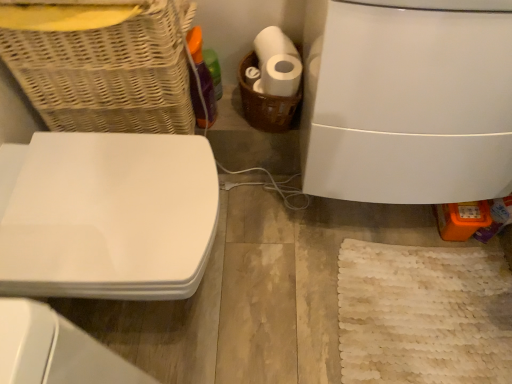
This screenshot has height=384, width=512. Describe the element at coordinates (110, 217) in the screenshot. I see `white glossy toilet seat at left` at that location.

Find the location of a particular element. Image resolution: width=512 pixels, height=384 pixels. woven wicker basket at upper left, which is counted as the second basket, starting from the right is located at coordinates (104, 67).

Considering the sizes of objects white glossy toilet seat at left and translucent purple bottle at upper left in the image provided, who is wider, white glossy toilet seat at left or translucent purple bottle at upper left?

white glossy toilet seat at left.

Is white glossy toilet seat at left at the right side of translucent purple bottle at upper left?

In fact, white glossy toilet seat at left is to the left of translucent purple bottle at upper left.

From the image's perspective, which one is positioned higher, white glossy toilet seat at left or translucent purple bottle at upper left?

translucent purple bottle at upper left.

Considering the points (11, 222) and (211, 120), which point is behind, point (11, 222) or point (211, 120)?

Positioned behind is point (211, 120).

Does woven wicker basket at upper left, which is counted as the second basket, starting from the right, have a smaller size compared to white glossy toilet seat at left?

Correct, woven wicker basket at upper left, which is counted as the second basket, starting from the right, occupies less space than white glossy toilet seat at left.

Which is behind, woven wicker basket at upper left, which is counted as the second basket, starting from the right, or white glossy toilet seat at left?

white glossy toilet seat at left is further from the camera.

Is woven wicker basket at upper left, which is counted as the second basket, starting from the right, smaller than white glossy toilet at right?

Indeed, woven wicker basket at upper left, which is counted as the second basket, starting from the right, has a smaller size compared to white glossy toilet at right.

Is woven wicker basket at upper left, which is counted as the second basket, starting from the right, not near white glossy toilet at right?

No, woven wicker basket at upper left, which is counted as the second basket, starting from the right, is in close proximity to white glossy toilet at right.

Consider the image. From a real-world perspective, between woven wicker basket at upper left, which is counted as the second basket, starting from the right, and white glossy toilet at right, who is vertically lower?

white glossy toilet at right is physically lower.

Which of these two, woven wicker basket at upper left, which is counted as the second basket, starting from the right, or white glossy toilet at right, is thinner?

Thinner between the two is woven wicker basket at upper left, which is counted as the second basket, starting from the right.

Who is shorter, brown woven basket at center, positioned as the first basket in right-to-left order, or white glossy toilet seat at left?

With less height is brown woven basket at center, positioned as the first basket in right-to-left order.

Which is behind, brown woven basket at center, positioned as the first basket in right-to-left order, or white glossy toilet seat at left?

brown woven basket at center, positioned as the first basket in right-to-left order, is further from the camera.

The image size is (512, 384). In the image, there is a brown woven basket at center, which is the second basket in left-to-right order. Find the location of `toilet below it (from the image's perspective)`. toilet below it (from the image's perspective) is located at coordinates (110, 217).

From a real-world perspective, relative to white glossy toilet seat at left, is brown woven basket at center, positioned as the first basket in right-to-left order, vertically above or below?

Clearly, from a real-world perspective, brown woven basket at center, positioned as the first basket in right-to-left order, is above white glossy toilet seat at left.

Are woven wicker basket at upper left, placed as the 1th basket when sorted from left to right, and brown woven basket at center, positioned as the first basket in right-to-left order, far apart?

No, there isn't a large distance between woven wicker basket at upper left, placed as the 1th basket when sorted from left to right, and brown woven basket at center, positioned as the first basket in right-to-left order.

From a real-world perspective, is woven wicker basket at upper left, placed as the 1th basket when sorted from left to right, positioned above or below brown woven basket at center, which is the second basket in left-to-right order?

In terms of real-world spatial position, woven wicker basket at upper left, placed as the 1th basket when sorted from left to right, is above brown woven basket at center, which is the second basket in left-to-right order.

What's the angular difference between woven wicker basket at upper left, which is counted as the second basket, starting from the right, and brown woven basket at center, which is the second basket in left-to-right order,'s facing directions?

2.1 degrees.

Is woven wicker basket at upper left, which is counted as the second basket, starting from the right, positioned before brown woven basket at center, which is the second basket in left-to-right order?

Yes, the depth of woven wicker basket at upper left, which is counted as the second basket, starting from the right, is less than that of brown woven basket at center, which is the second basket in left-to-right order.

Which is in front, brown woven basket at center, positioned as the first basket in right-to-left order, or translucent purple bottle at upper left?

Positioned in front is translucent purple bottle at upper left.

Find the location of a particular element. The height and width of the screenshot is (384, 512). bottle in front of the brown woven basket at center, positioned as the first basket in right-to-left order is located at coordinates (202, 73).

Does brown woven basket at center, positioned as the first basket in right-to-left order, have a lesser width compared to translucent purple bottle at upper left?

No, brown woven basket at center, positioned as the first basket in right-to-left order, is not thinner than translucent purple bottle at upper left.

Is translucent purple bottle at upper left surrounded by brown woven basket at center, which is the second basket in left-to-right order?

No.

Considering the sizes of objects brown woven basket at center, which is the second basket in left-to-right order, and white glossy toilet at right in the image provided, who is thinner, brown woven basket at center, which is the second basket in left-to-right order, or white glossy toilet at right?

brown woven basket at center, which is the second basket in left-to-right order, is thinner.

Locate an element on the screen. The image size is (512, 384). appliance in front of the brown woven basket at center, which is the second basket in left-to-right order is located at coordinates (407, 100).

From the image's perspective, is brown woven basket at center, positioned as the first basket in right-to-left order, positioned above or below white glossy toilet at right?

Clearly, from the image's perspective, brown woven basket at center, positioned as the first basket in right-to-left order, is above white glossy toilet at right.

Considering the relative sizes of brown woven basket at center, positioned as the first basket in right-to-left order, and white glossy toilet at right in the image provided, is brown woven basket at center, positioned as the first basket in right-to-left order, smaller than white glossy toilet at right?

Correct, brown woven basket at center, positioned as the first basket in right-to-left order, occupies less space than white glossy toilet at right.

You are a GUI agent. You are given a task and a screenshot of the screen. Output one action in this format:
    pyautogui.click(x=<x>, y=<y>)
    Task: Click on the toilet in front of the translucent purple bottle at upper left
    The height and width of the screenshot is (384, 512).
    Given the screenshot: What is the action you would take?
    pyautogui.click(x=110, y=217)

Find the location of a particular element. This screenshot has width=512, height=384. toilet to the left of woven wicker basket at upper left, placed as the 1th basket when sorted from left to right is located at coordinates (110, 217).

Estimate the real-world distances between objects in this image. Which object is further from brown woven basket at center, which is the second basket in left-to-right order, white glossy toilet at right or translucent purple bottle at upper left?

white glossy toilet at right is positioned further to the anchor brown woven basket at center, which is the second basket in left-to-right order.

In the scene shown: From the image, which object appears to be farther from brown woven basket at center, positioned as the first basket in right-to-left order, white glossy toilet at right or woven wicker basket at upper left, placed as the 1th basket when sorted from left to right?

Among the two, woven wicker basket at upper left, placed as the 1th basket when sorted from left to right, is located further to brown woven basket at center, positioned as the first basket in right-to-left order.

Estimate the real-world distances between objects in this image. Which object is closer to translucent purple bottle at upper left, white glossy toilet at right or brown woven basket at center, positioned as the first basket in right-to-left order?

brown woven basket at center, positioned as the first basket in right-to-left order, is positioned closer to the anchor translucent purple bottle at upper left.

In the scene shown: Based on their spatial positions, is brown woven basket at center, positioned as the first basket in right-to-left order, or woven wicker basket at upper left, placed as the 1th basket when sorted from left to right, further from white glossy toilet seat at left?

Among the two, brown woven basket at center, positioned as the first basket in right-to-left order, is located further to white glossy toilet seat at left.

Looking at the image, which one is located further to white glossy toilet at right, brown woven basket at center, positioned as the first basket in right-to-left order, or translucent purple bottle at upper left?

translucent purple bottle at upper left lies further to white glossy toilet at right than the other object.

Estimate the real-world distances between objects in this image. Which object is closer to woven wicker basket at upper left, which is counted as the second basket, starting from the right, translucent purple bottle at upper left or brown woven basket at center, which is the second basket in left-to-right order?

translucent purple bottle at upper left.

Looking at the image, which one is located further to white glossy toilet seat at left, woven wicker basket at upper left, placed as the 1th basket when sorted from left to right, or translucent purple bottle at upper left?

Among the two, translucent purple bottle at upper left is located further to white glossy toilet seat at left.

From the picture: Looking at the image, which one is located closer to translucent purple bottle at upper left, white glossy toilet at right or white glossy toilet seat at left?

white glossy toilet seat at left is positioned closer to the anchor translucent purple bottle at upper left.

Where is `basket between woven wicker basket at upper left, which is counted as the second basket, starting from the right, and white glossy toilet at right from left to right`? The height and width of the screenshot is (384, 512). basket between woven wicker basket at upper left, which is counted as the second basket, starting from the right, and white glossy toilet at right from left to right is located at coordinates (266, 103).

I want to click on basket between translucent purple bottle at upper left and white glossy toilet at right, so click(266, 103).

At what (x,y) coordinates should I click in order to perform the action: click on bottle between brown woven basket at center, positioned as the first basket in right-to-left order, and white glossy toilet seat at left, in the vertical direction. Please return your answer as a coordinate pair (x, y). Image resolution: width=512 pixels, height=384 pixels. Looking at the image, I should click on (202, 73).

At what (x,y) coordinates should I click in order to perform the action: click on bottle situated between woven wicker basket at upper left, placed as the 1th basket when sorted from left to right, and white glossy toilet at right from left to right. Please return your answer as a coordinate pair (x, y). Looking at the image, I should click on (202, 73).